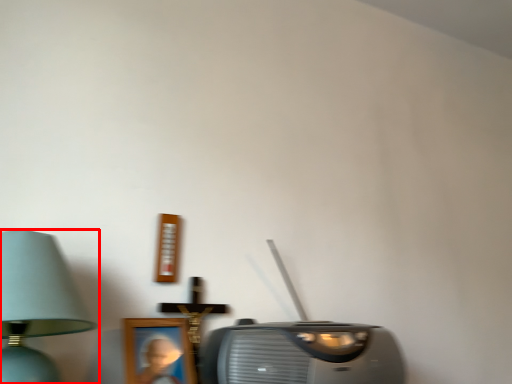
Question: Observing the image, what is the correct spatial positioning of lamp (annotated by the red box) in reference to stereo?

Choices:
 (A) left
 (B) right

Answer: (A)